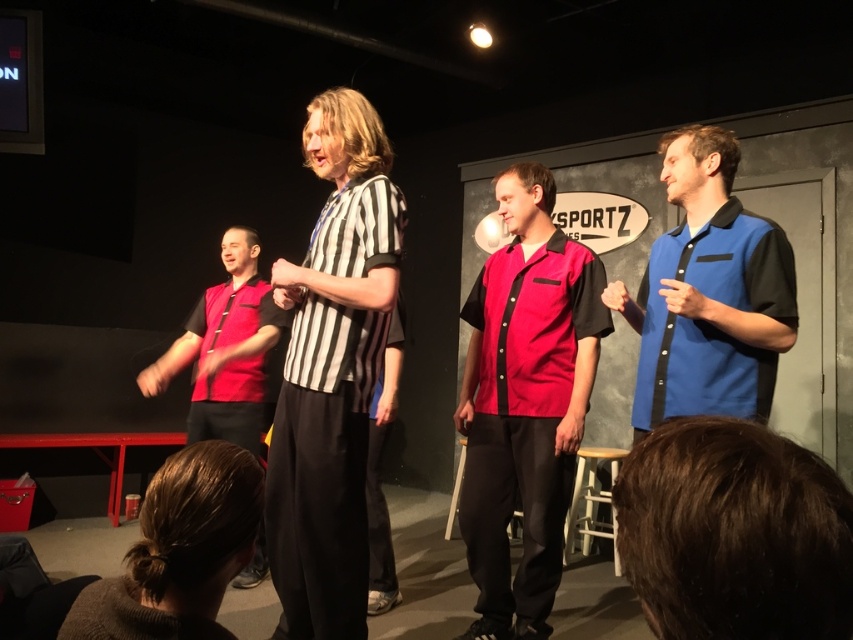
Question: Does black striped shirt at center have a larger size compared to matte red shirt at center?

Choices:
 (A) yes
 (B) no

Answer: (B)

Question: Which point is closer to the camera?

Choices:
 (A) (256, 445)
 (B) (283, 440)
 (C) (688, 269)
 (D) (514, 376)

Answer: (B)

Question: Can you confirm if shiny red bowling shirt at center is bigger than matte red shirt at center?

Choices:
 (A) yes
 (B) no

Answer: (B)

Question: Which object appears closest to the camera in this image?

Choices:
 (A) black striped shirt at center
 (B) shiny red bowling shirt at center
 (C) matte red shirt at center
 (D) blue smooth shirt at right

Answer: (D)

Question: Which point is farther from the camera taking this photo?

Choices:
 (A) (543, 412)
 (B) (259, 406)
 (C) (640, 330)

Answer: (B)

Question: Can you confirm if black striped shirt at center is thinner than blue smooth shirt at right?

Choices:
 (A) no
 (B) yes

Answer: (B)